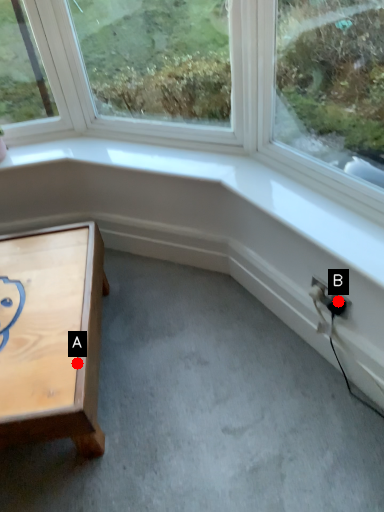
Question: Two points are circled on the image, labeled by A and B beside each circle. Among these points, which one is nearest to the camera?

Choices:
 (A) A is closer
 (B) B is closer

Answer: (A)